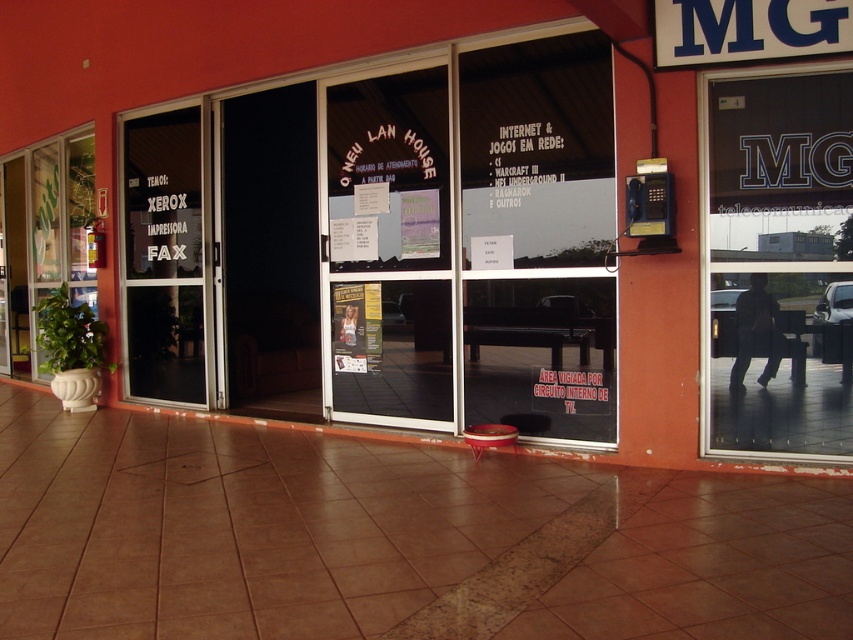
Between point (180, 300) and point (39, 268), which one is positioned behind?

Point (39, 268)

What are the coordinates of `transparent glass door at center` in the screenshot? It's located at (164, 257).

Is point (845, 340) positioned after point (10, 348)?

No, it is in front of (10, 348).

Does transparent glass door at upper right have a smaller size compared to green leafy plant at left?

Yes, transparent glass door at upper right is smaller than green leafy plant at left.

Between point (714, 326) and point (32, 260), which one is positioned behind?

Point (32, 260)

Locate an element on the screen. transparent glass door at upper right is located at coordinates (780, 260).

How far apart are transparent glass door at upper right and transparent glass door at center?

4.81 meters

Who is taller, transparent glass door at upper right or transparent glass door at center?

With more height is transparent glass door at center.

The image size is (853, 640). What do you see at coordinates (780, 260) in the screenshot? I see `transparent glass door at upper right` at bounding box center [780, 260].

Locate an element on the screen. transparent glass door at upper right is located at coordinates (780, 260).